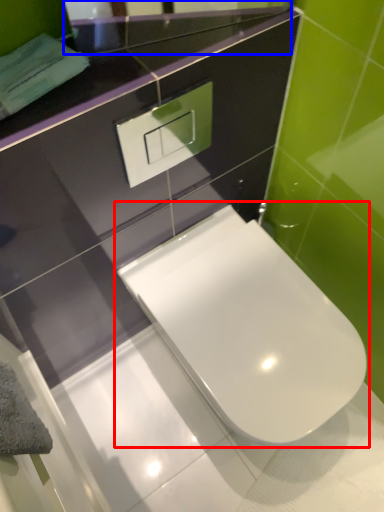
Question: Which point is further to the camera, toilet (highlighted by a red box) or mirror (highlighted by a blue box)?

Choices:
 (A) toilet
 (B) mirror

Answer: (A)